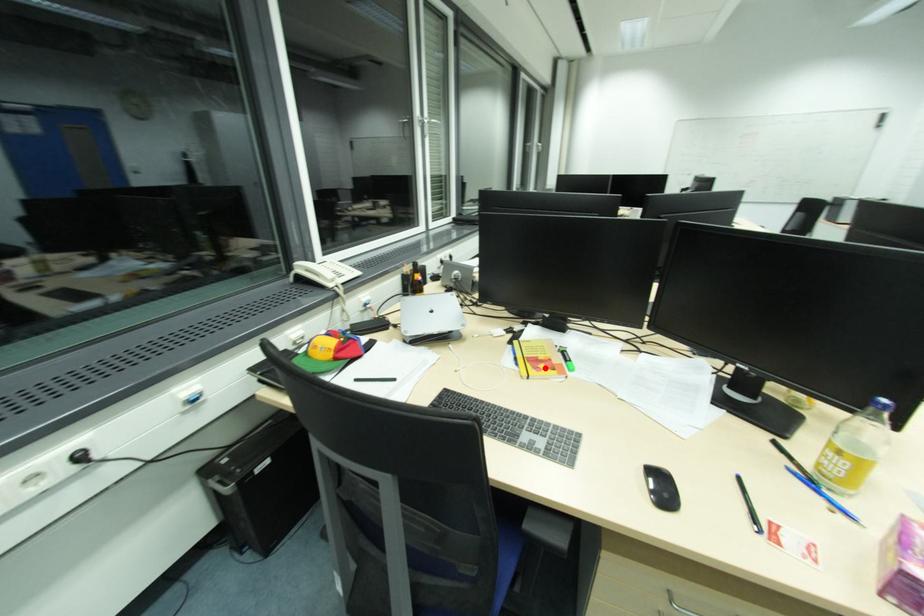
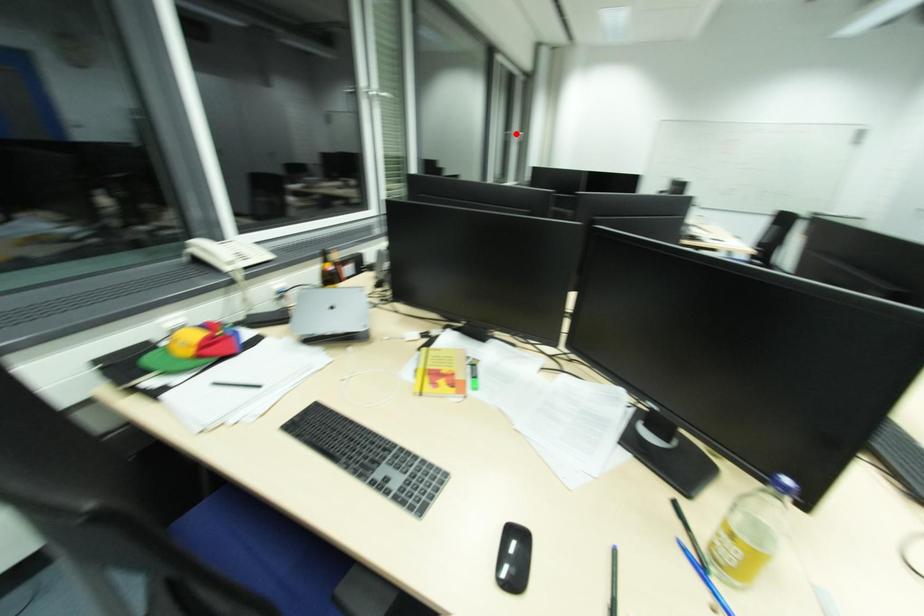
I am providing you with two images of the same scene from different viewpoints. A red point is marked on the first image and another point is marked on the second image. Are the points marked in image1 and image2 representing the same 3D position?

No